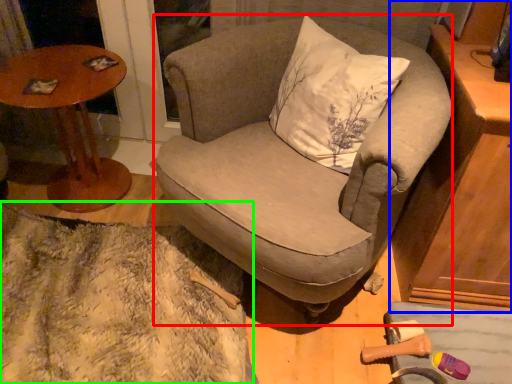
Question: Which object is the closest to the chair (highlighted by a red box)? Choose among these: cabinetry (highlighted by a blue box) or blanket (highlighted by a green box).

Choices:
 (A) cabinetry
 (B) blanket

Answer: (A)